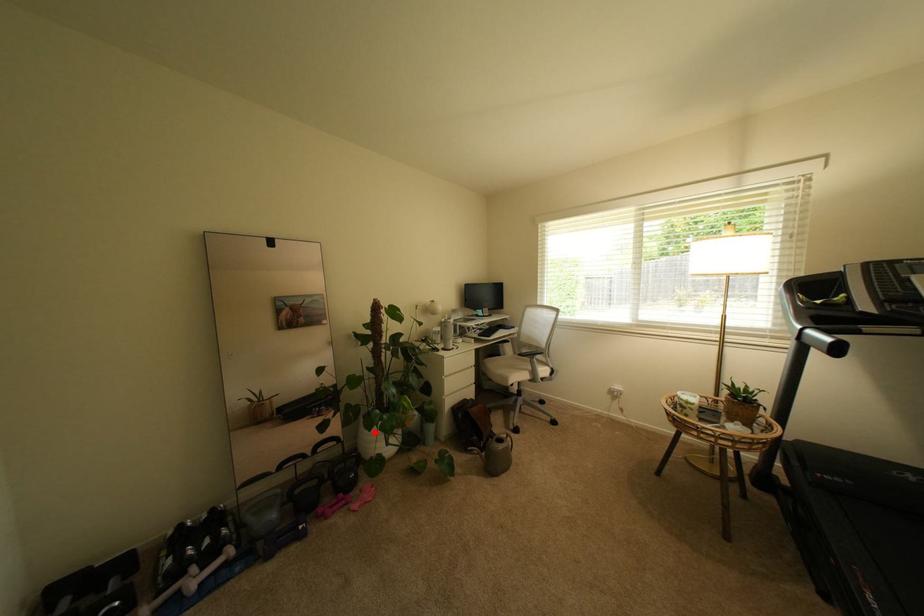
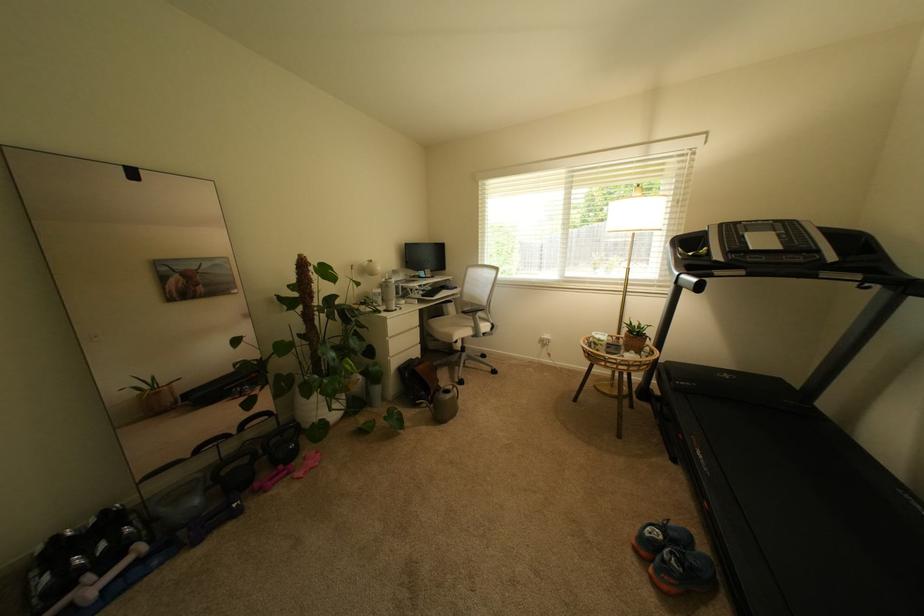
The point at the highlighted location is marked in the first image. Where is the corresponding point in the second image?

(312, 400)